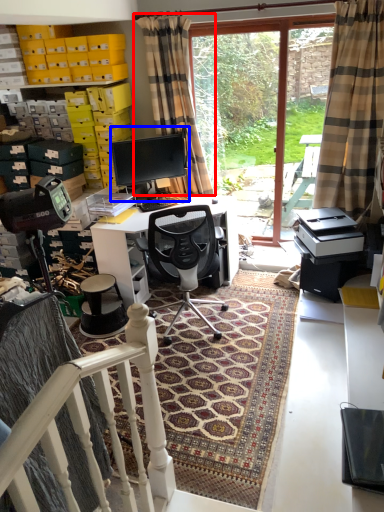
Question: Among these objects, which one is nearest to the camera, curtain (highlighted by a red box) or computer monitor (highlighted by a blue box)?

Choices:
 (A) curtain
 (B) computer monitor

Answer: (A)